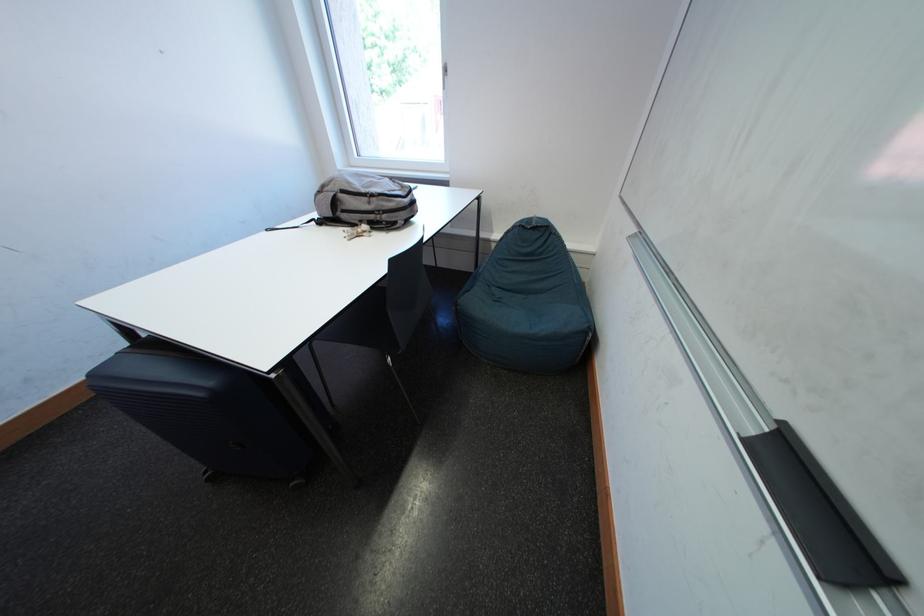
The location [819,513] corresponds to which object?

This point indicates the black whiteboard eraser.